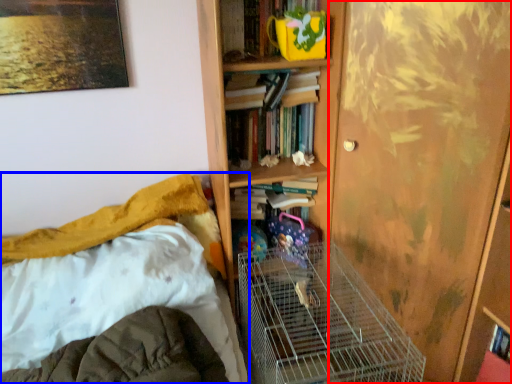
Question: Which object is closer to the camera taking this photo, screen door (highlighted by a red box) or bed (highlighted by a blue box)?

Choices:
 (A) screen door
 (B) bed

Answer: (B)